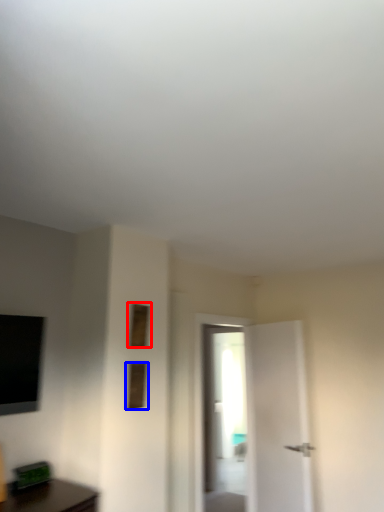
Question: Among these objects, which one is farthest to the camera, window (highlighted by a red box) or window (highlighted by a blue box)?

Choices:
 (A) window
 (B) window

Answer: (A)